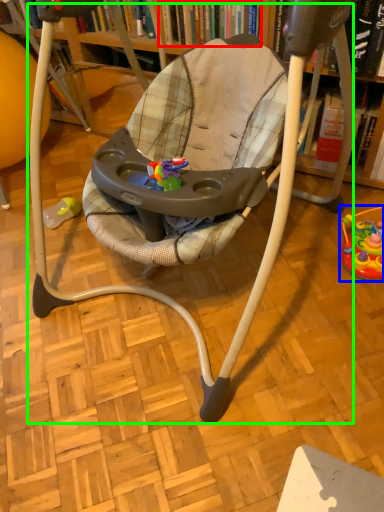
Question: Considering the real-world distances, which object is closest to book (highlighted by a red box)? toy (highlighted by a blue box) or baby carriage (highlighted by a green box).

Choices:
 (A) toy
 (B) baby carriage

Answer: (B)